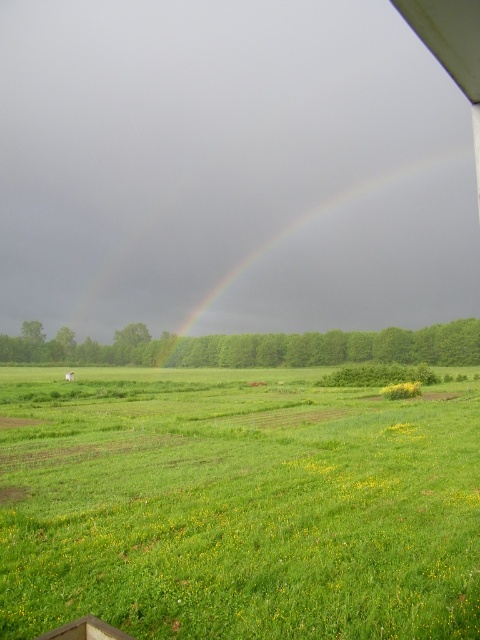
The width and height of the screenshot is (480, 640). What do you see at coordinates (238, 506) in the screenshot?
I see `green grassy field at lower center` at bounding box center [238, 506].

Is green grassy field at lower center taller than rainbow at center?

Incorrect, green grassy field at lower center's height is not larger of rainbow at center's.

You are a GUI agent. You are given a task and a screenshot of the screen. Output one action in this format:
    pyautogui.click(x=<x>, y=<y>)
    Task: Click on the green grassy field at lower center
    
    Given the screenshot: What is the action you would take?
    coord(238,506)